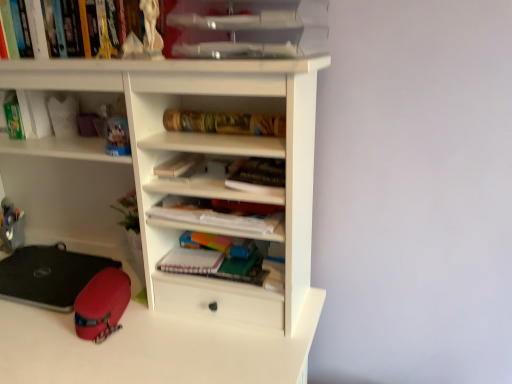
The width and height of the screenshot is (512, 384). I want to click on free space above gold metallic tube at center, arranged as the third book when ordered from the bottom (from a real-world perspective), so click(228, 108).